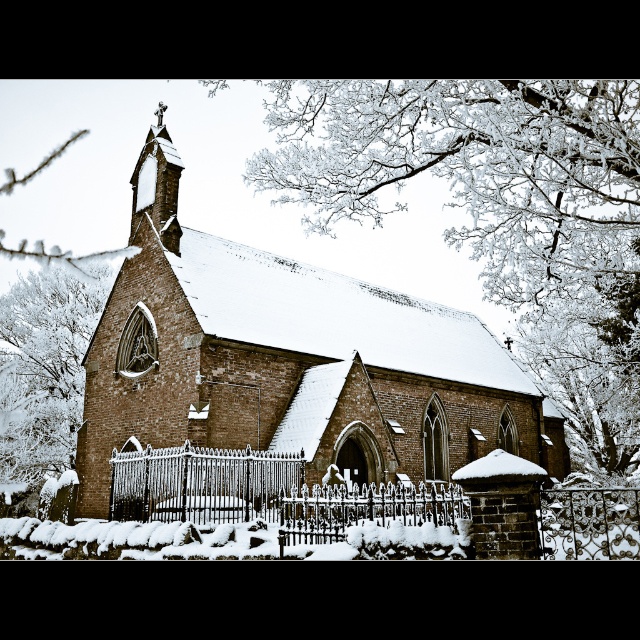
You are a visitor approaching the church and notice two fences in front of it. The scene shows a silver wrought iron fence at center and a black wrought iron fence at center. Which fence do you think is taller?

The silver wrought iron fence at center is taller than the black wrought iron fence at center according to the description.

You are standing in front of the church and want to take a closer look at the white frosty branches at left and the black wrought iron fence at center. Which object will you reach first as you walk towards the church?

You will reach the white frosty branches at left first because it is closer to you than the black wrought iron fence at center, which is further away.

You are a photographer wanting to capture both the brown brick church at center and the black wrought iron fence at center in a single frame. Given their sizes, which object should be placed closer to the camera to ensure both are clearly visible in the photo?

The brown brick church at center is larger than the black wrought iron fence at center. To ensure both are clearly visible, the black wrought iron fence at center should be placed closer to the camera since it is smaller, allowing the photographer to capture details of both without one overwhelming the frame.